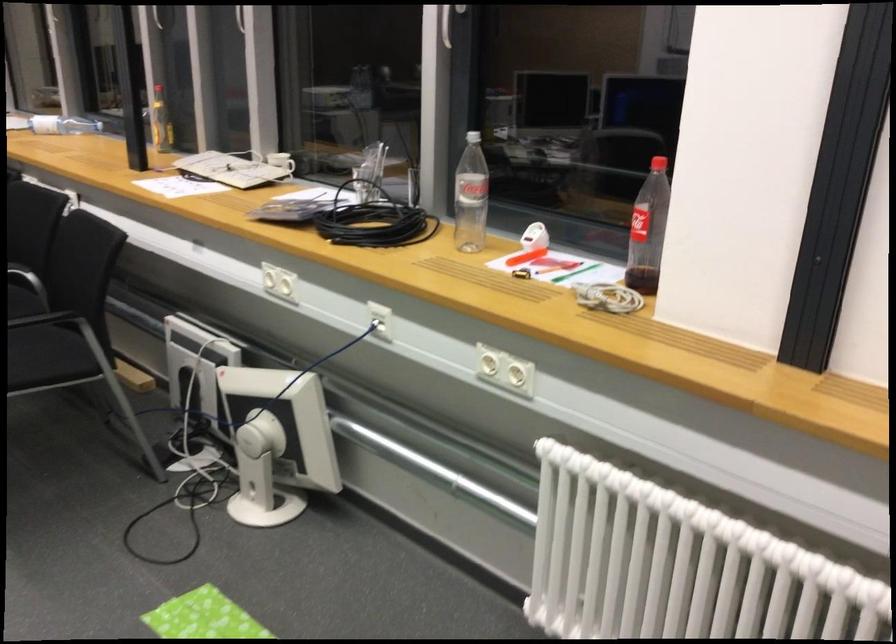
The width and height of the screenshot is (896, 644). What do you see at coordinates (280, 162) in the screenshot?
I see `the white mug handle` at bounding box center [280, 162].